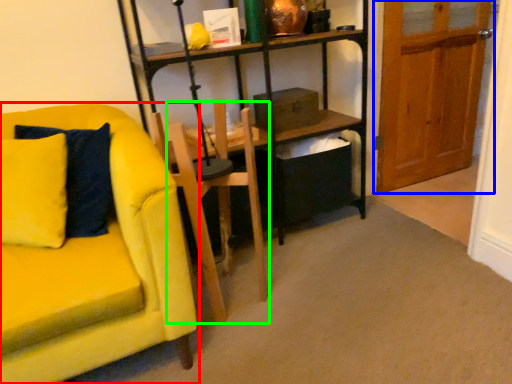
Question: Based on their relative distances, which object is farther from chair (highlighted by a red box)? Choose from door (highlighted by a blue box) and armchair (highlighted by a green box).

Choices:
 (A) door
 (B) armchair

Answer: (A)